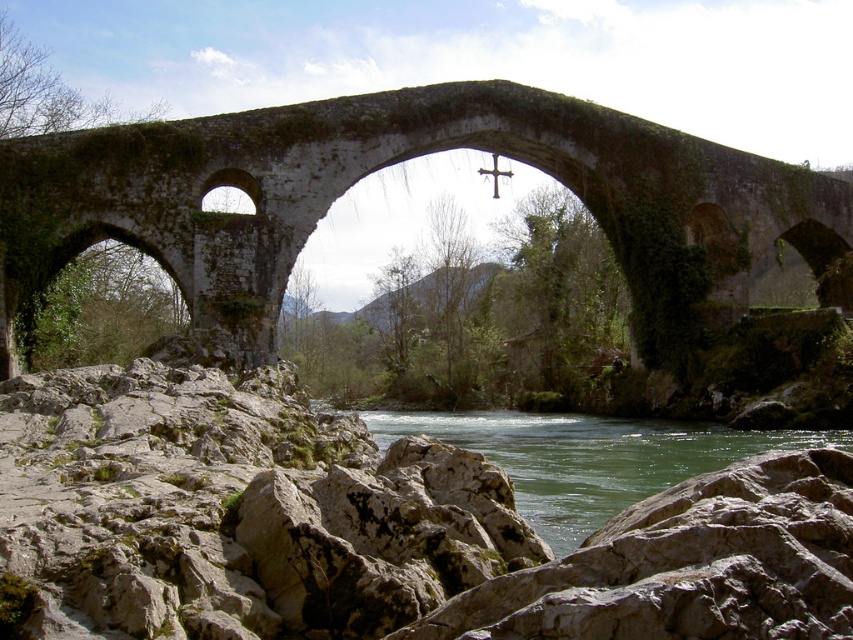
Question: Does stone arch bridge at center appear over green stone river at center?

Choices:
 (A) yes
 (B) no

Answer: (A)

Question: Which point is closer to the camera taking this photo?

Choices:
 (A) (746, 586)
 (B) (479, 168)
 (C) (738, 248)

Answer: (A)

Question: Estimate the real-world distances between objects in this image. Which object is closer to the stone arch bridge at center?

Choices:
 (A) gray rough rock at lower center
 (B) green stone river at center

Answer: (B)

Question: Which point is farther to the camera?

Choices:
 (A) (775, 500)
 (B) (489, 435)

Answer: (B)

Question: Is stone arch bridge at center wider than green stone river at center?

Choices:
 (A) yes
 (B) no

Answer: (A)

Question: Can you confirm if gray rough rock at lower center is bigger than green stone river at center?

Choices:
 (A) yes
 (B) no

Answer: (A)